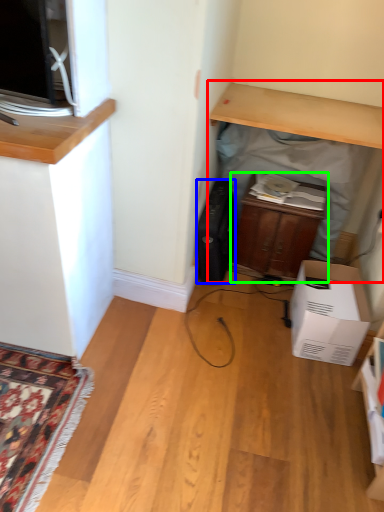
Question: Based on their relative distances, which object is farther from computer desk (highlighted by a red box)? Choose from appliance (highlighted by a blue box) and cabinetry (highlighted by a green box).

Choices:
 (A) appliance
 (B) cabinetry

Answer: (A)